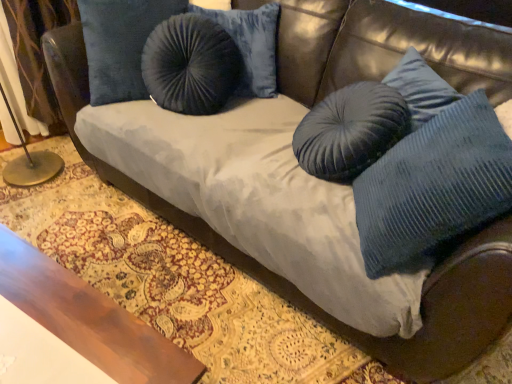
Describe the element at coordinates (37, 53) in the screenshot. I see `velvet curtain at left` at that location.

Find the location of `velvet curtain at left`. velvet curtain at left is located at coordinates (37, 53).

Is blue corduroy pillow at right positioned far away from wooden table at lower left?

No, blue corduroy pillow at right is not far away from wooden table at lower left.

Relative to wooden table at lower left, is blue corduroy pillow at right in front or behind?

In the image, blue corduroy pillow at right appears behind wooden table at lower left.

From the image's perspective, which object appears higher, blue corduroy pillow at right or wooden table at lower left?

blue corduroy pillow at right.

Can you confirm if blue corduroy pillow at right is bigger than wooden table at lower left?

Incorrect, blue corduroy pillow at right is not larger than wooden table at lower left.

Can you confirm if blue corduroy pillow at right is shorter than velvet curtain at left?

Indeed, blue corduroy pillow at right has a lesser height compared to velvet curtain at left.

Does blue corduroy pillow at right turn towards velvet curtain at left?

Yes, blue corduroy pillow at right is oriented towards velvet curtain at left.

Can you confirm if blue corduroy pillow at right is bigger than velvet curtain at left?

Correct, blue corduroy pillow at right is larger in size than velvet curtain at left.

Identify the location of pillow on the right of velvet curtain at left. The width and height of the screenshot is (512, 384). (434, 187).

Does velvet curtain at left have a smaller size compared to wooden table at lower left?

Indeed, velvet curtain at left has a smaller size compared to wooden table at lower left.

Could you tell me if velvet curtain at left is turned towards wooden table at lower left?

Yes, velvet curtain at left is facing wooden table at lower left.

From the image's perspective, would you say velvet curtain at left is shown under wooden table at lower left?

No, from the image's perspective, velvet curtain at left is not beneath wooden table at lower left.

Consider the image. Is velvet curtain at left bigger than blue corduroy pillow at right?

No.

Considering the sizes of objects velvet curtain at left and blue corduroy pillow at right in the image provided, who is wider, velvet curtain at left or blue corduroy pillow at right?

velvet curtain at left.

Is velvet curtain at left aimed at blue corduroy pillow at right?

No, velvet curtain at left is not aimed at blue corduroy pillow at right.

Which object is closer to the camera taking this photo, velvet curtain at left or blue corduroy pillow at right?

blue corduroy pillow at right is more forward.

From a real-world perspective, which is physically above, wooden table at lower left or blue corduroy pillow at right?

blue corduroy pillow at right, from a real-world perspective.

Based on the photo, is blue corduroy pillow at right located within wooden table at lower left?

No, wooden table at lower left does not contain blue corduroy pillow at right.

Which is in front, wooden table at lower left or blue corduroy pillow at right?

wooden table at lower left is in front.

From the image's perspective, who appears lower, wooden table at lower left or velvet curtain at left?

wooden table at lower left appears lower in the image.

This screenshot has height=384, width=512. Find the location of `curtain that is on the left side of wooden table at lower left`. curtain that is on the left side of wooden table at lower left is located at coordinates (37, 53).

Does point (124, 378) come closer to viewer compared to point (53, 132)?

That is True.

Identify the location of pillow above the wooden table at lower left (from the image's perspective). This screenshot has height=384, width=512. (434, 187).

The width and height of the screenshot is (512, 384). Identify the location of pillow to the right of velvet curtain at left. (434, 187).

Which object lies nearer to the anchor point blue corduroy pillow at right, wooden table at lower left or velvet curtain at left?

The object closer to blue corduroy pillow at right is wooden table at lower left.

From the image, which object appears to be farther from velvet curtain at left, blue corduroy pillow at right or wooden table at lower left?

blue corduroy pillow at right is positioned further to the anchor velvet curtain at left.

Considering their positions, is wooden table at lower left positioned further to velvet curtain at left than blue corduroy pillow at right?

Based on the image, blue corduroy pillow at right appears to be further to velvet curtain at left.

Which object lies nearer to the anchor point blue corduroy pillow at right, velvet curtain at left or wooden table at lower left?

wooden table at lower left.

Based on their spatial positions, is blue corduroy pillow at right or velvet curtain at left closer to wooden table at lower left?

blue corduroy pillow at right is closer to wooden table at lower left.

From the picture: Estimate the real-world distances between objects in this image. Which object is closer to wooden table at lower left, velvet curtain at left or blue corduroy pillow at right?

Based on the image, blue corduroy pillow at right appears to be nearer to wooden table at lower left.

Locate an element on the screen. table between velvet curtain at left and blue corduroy pillow at right in the horizontal direction is located at coordinates (89, 319).